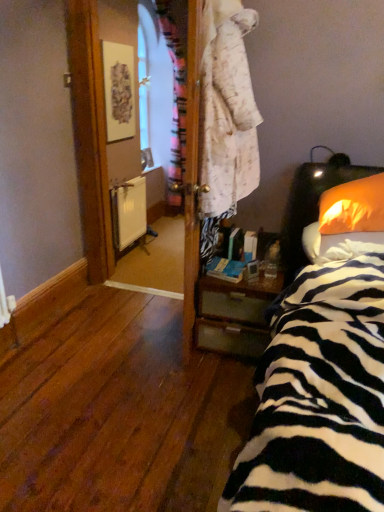
Question: Is wooden nightstand at lower right at the right side of orange fabric pillow at right, the second pillow in the bottom-to-top sequence?

Choices:
 (A) no
 (B) yes

Answer: (A)

Question: Considering the relative sizes of wooden nightstand at lower right and orange fabric pillow at right, the 1th pillow in the top-to-bottom sequence, in the image provided, is wooden nightstand at lower right shorter than orange fabric pillow at right, the 1th pillow in the top-to-bottom sequence,?

Choices:
 (A) no
 (B) yes

Answer: (A)

Question: Can you confirm if wooden nightstand at lower right is taller than orange fabric pillow at right, the second pillow in the bottom-to-top sequence?

Choices:
 (A) no
 (B) yes

Answer: (B)

Question: Is wooden nightstand at lower right not inside orange fabric pillow at right, the second pillow in the bottom-to-top sequence?

Choices:
 (A) no
 (B) yes

Answer: (B)

Question: Considering the relative sizes of wooden nightstand at lower right and orange fabric pillow at right, the second pillow in the bottom-to-top sequence, in the image provided, is wooden nightstand at lower right smaller than orange fabric pillow at right, the second pillow in the bottom-to-top sequence,?

Choices:
 (A) yes
 (B) no

Answer: (B)

Question: From the image's perspective, would you say wooden nightstand at lower right is shown under orange fabric pillow at right, the second pillow in the bottom-to-top sequence?

Choices:
 (A) no
 (B) yes

Answer: (B)

Question: From a real-world perspective, is white matte radiator at center physically below wooden nightstand at lower right?

Choices:
 (A) yes
 (B) no

Answer: (B)

Question: Is white matte radiator at center oriented away from wooden nightstand at lower right?

Choices:
 (A) no
 (B) yes

Answer: (A)

Question: Is white matte radiator at center shorter than wooden nightstand at lower right?

Choices:
 (A) no
 (B) yes

Answer: (A)

Question: From the image's perspective, is white matte radiator at center above wooden nightstand at lower right?

Choices:
 (A) yes
 (B) no

Answer: (A)

Question: Could you tell me if white matte radiator at center is facing wooden nightstand at lower right?

Choices:
 (A) no
 (B) yes

Answer: (A)

Question: Considering the relative sizes of white matte radiator at center and wooden nightstand at lower right in the image provided, is white matte radiator at center smaller than wooden nightstand at lower right?

Choices:
 (A) yes
 (B) no

Answer: (A)

Question: From a real-world perspective, is orange fabric pillow at right, which is the second pillow in top-to-bottom order, located higher than wooden nightstand at lower right?

Choices:
 (A) yes
 (B) no

Answer: (A)